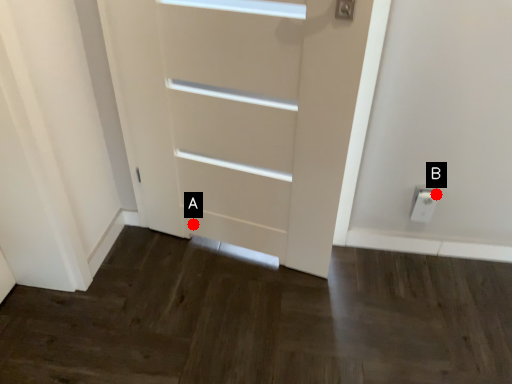
Question: Two points are circled on the image, labeled by A and B beside each circle. Which of the following is the closest to the observer?

Choices:
 (A) A is closer
 (B) B is closer

Answer: (B)